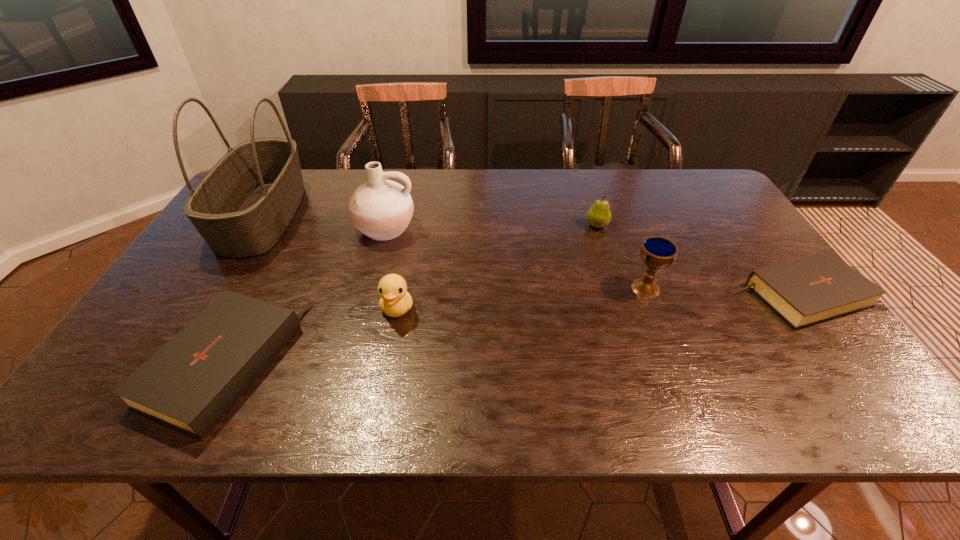
You are a GUI agent. You are given a task and a screenshot of the screen. Output one action in this format:
    pyautogui.click(x=<x>, y=<y>)
    Task: Click on the free space between the sixth shortest object and the duck
    This screenshot has width=960, height=540.
    Given the screenshot: What is the action you would take?
    pyautogui.click(x=391, y=268)

The image size is (960, 540). Identify the location of free area in between the tallest object and the pear. (430, 221).

Locate an element on the screen. The image size is (960, 540). free space between the basket and the second tallest object is located at coordinates (324, 222).

The width and height of the screenshot is (960, 540). Identify the location of free point between the tallest object and the second tallest object. (324, 222).

Locate an element on the screen. This screenshot has height=540, width=960. free space between the pottery and the second shortest object is located at coordinates (304, 296).

Identify the location of free space between the second shortest object and the duck. Image resolution: width=960 pixels, height=540 pixels. (310, 336).

You are a GUI agent. You are given a task and a screenshot of the screen. Output one action in this format:
    pyautogui.click(x=<x>, y=<y>)
    Task: Click on the vacant area between the chalice and the shorter Bible
    
    Given the screenshot: What is the action you would take?
    pyautogui.click(x=722, y=292)

Find the location of a particular element. The height and width of the screenshot is (540, 960). object that is the fourth nearest to the pottery is located at coordinates (599, 215).

What are the coordinates of `object that can be found as the second closest to the pottery` in the screenshot? It's located at (241, 208).

Locate an element on the screen. blank area in the image that satisfies the following two spatial constraints: 1. on the back side of the sixth tallest object; 2. on the left side of the third tallest object is located at coordinates (263, 288).